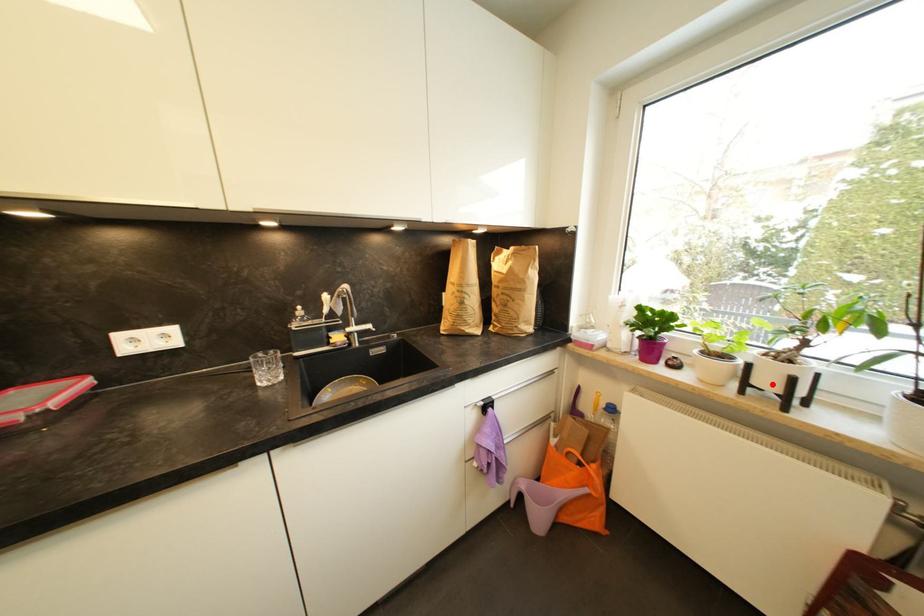
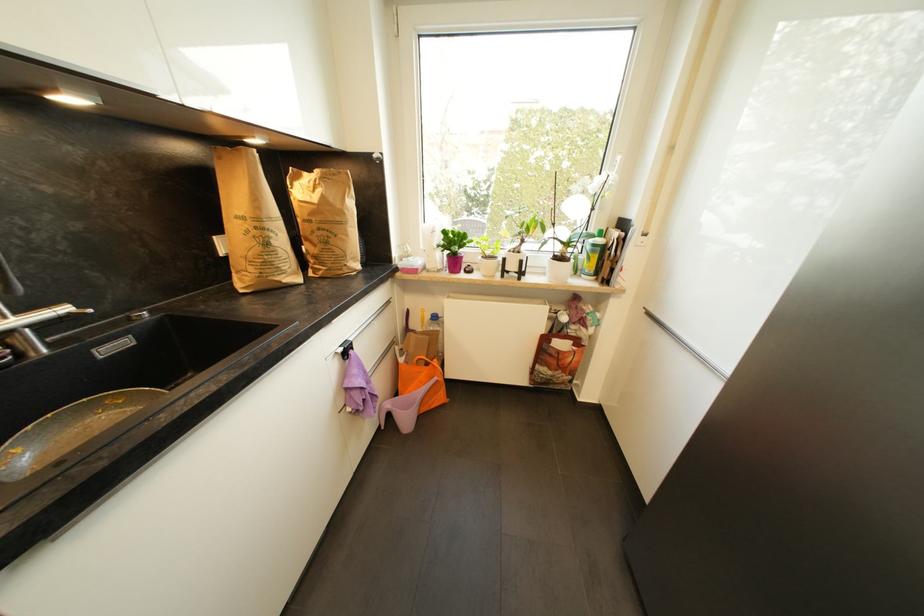
The point at the highlighted location is marked in the first image. Where is the corresponding point in the second image?

(517, 268)